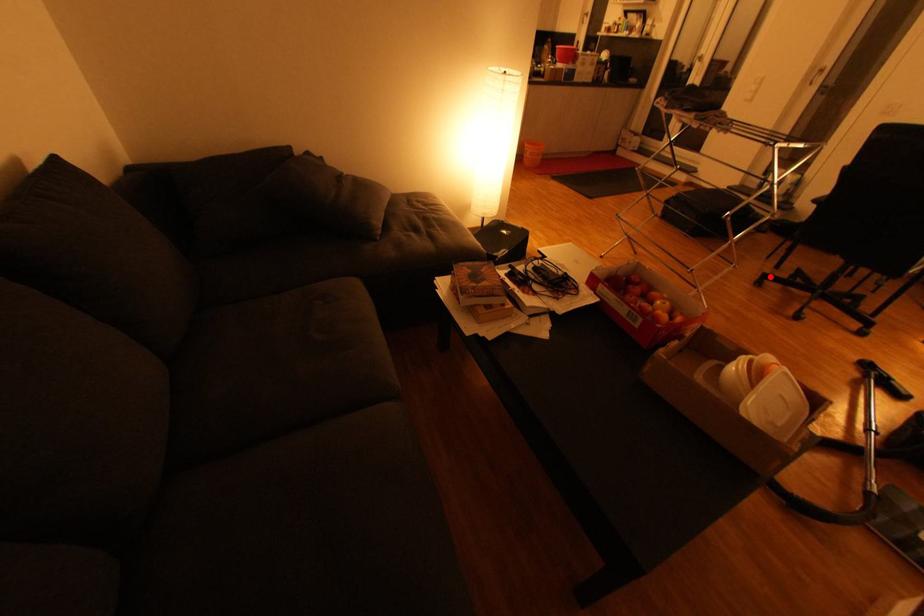
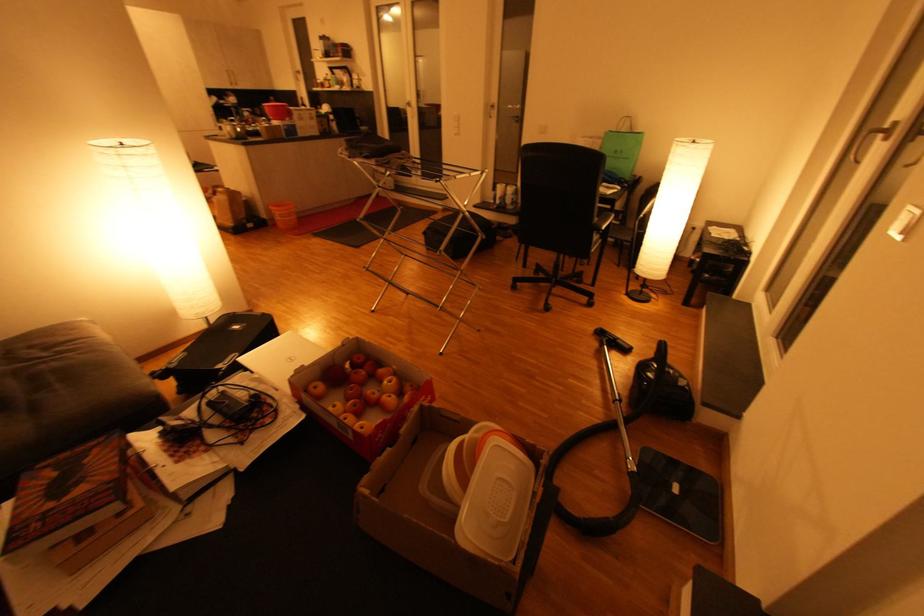
In the second image, find the point that corresponds to the highlighted location in the first image.

(520, 281)